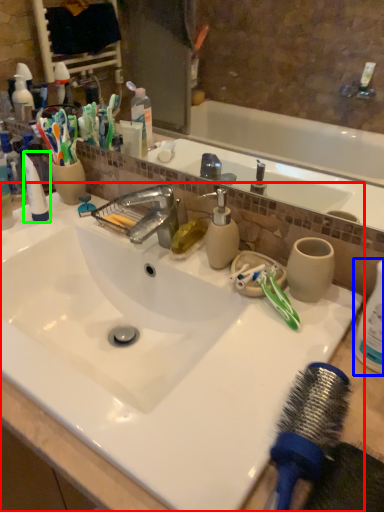
Question: Considering the real-world distances, which object is farthest from sink (highlighted by a red box)? cleaning product (highlighted by a blue box) or toothpaste (highlighted by a green box)?

Choices:
 (A) cleaning product
 (B) toothpaste

Answer: (A)